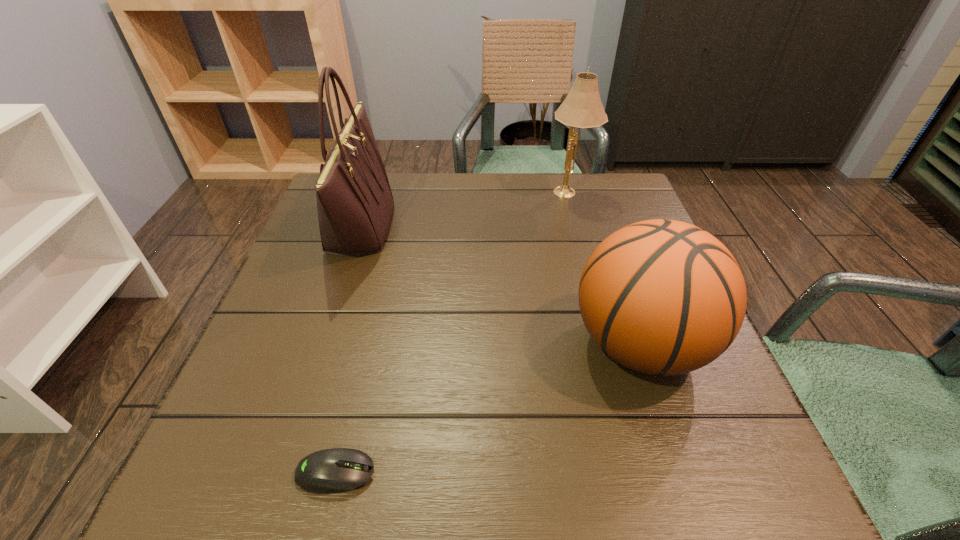
This screenshot has height=540, width=960. What are the coordinates of `empty space that is in between the handbag and the lampshade` in the screenshot? It's located at (465, 209).

Locate an element on the screen. The width and height of the screenshot is (960, 540). vacant area that lies between the basketball and the shortest object is located at coordinates (488, 408).

The height and width of the screenshot is (540, 960). I want to click on free space between the handbag and the lampshade, so click(465, 209).

You are a GUI agent. You are given a task and a screenshot of the screen. Output one action in this format:
    pyautogui.click(x=<x>, y=<y>)
    Task: Click on the free space that is in between the handbag and the shortest object
    
    Given the screenshot: What is the action you would take?
    348,349

I want to click on free point between the shortest object and the handbag, so click(348, 349).

Point out which object is positioned as the second nearest to the second shortest object. Please provide its 2D coordinates. Your answer should be formatted as a tuple, i.e. [(x, y)], where the tuple contains the x and y coordinates of a point satisfying the conditions above.

[(336, 470)]

The height and width of the screenshot is (540, 960). In order to click on object identified as the closest to the shortest object in this screenshot , I will do `click(664, 297)`.

Identify the location of vacant space that satisfies the following two spatial constraints: 1. on the front side of the lampshade; 2. on the front-facing side of the handbag. (578, 226).

This screenshot has height=540, width=960. What are the coordinates of `vacant area that satisfies the following two spatial constraints: 1. on the front-facing side of the handbag; 2. on the back side of the basketball` in the screenshot? It's located at (321, 343).

The width and height of the screenshot is (960, 540). Find the location of `vacant space that satisfies the following two spatial constraints: 1. on the front side of the lampshade; 2. on the front-facing side of the handbag`. vacant space that satisfies the following two spatial constraints: 1. on the front side of the lampshade; 2. on the front-facing side of the handbag is located at coordinates (578, 226).